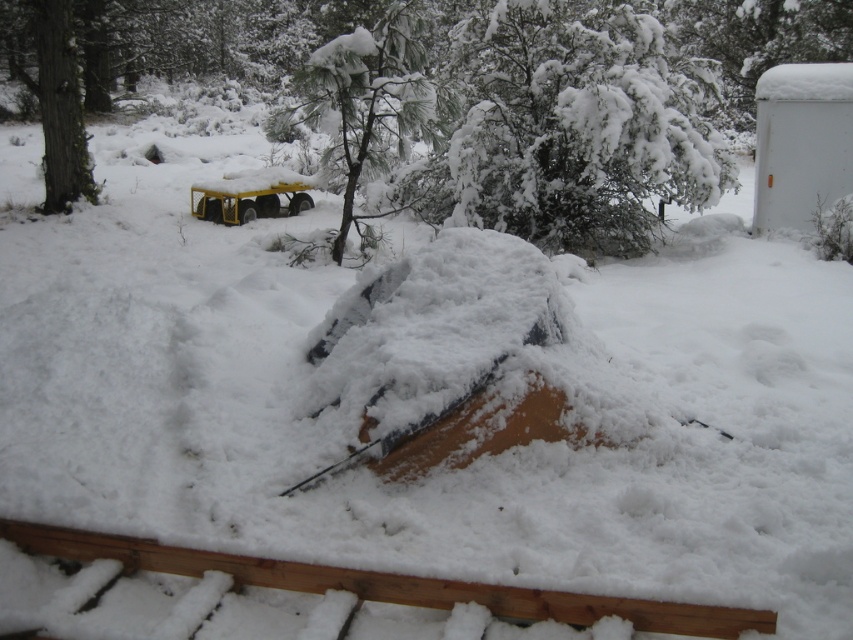
From the picture: You are an observer standing in the snowy area. You see a white fluffy tree at upper center and a smooth bark tree at upper left. Which tree has a narrower width?

The white fluffy tree at upper center has a lesser width compared to the smooth bark tree at upper left, so it is narrower.

You are standing at the wooden structure partially buried under snow in the foreground and want to reach the white fluffy tree at upper center. Which direction should you move to get closer to the tree?

The white fluffy tree at upper center is located at point (579, 124), so you should move towards the upper center direction to reach it.